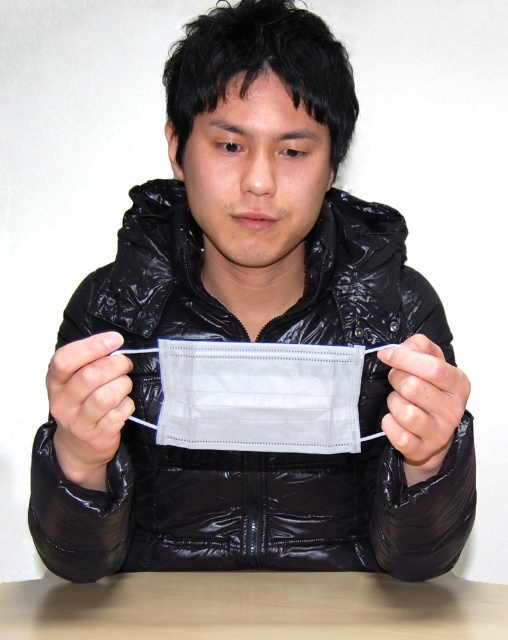
Question: Can you confirm if black shiny jacket at center is positioned to the right of white matte fabric mask at center?

Choices:
 (A) no
 (B) yes

Answer: (B)

Question: Is light brown wooden table at lower center to the right of white matte fabric mask at center from the viewer's perspective?

Choices:
 (A) no
 (B) yes

Answer: (B)

Question: Does light brown wooden table at lower center have a larger size compared to white matte mask at center?

Choices:
 (A) no
 (B) yes

Answer: (B)

Question: Based on their relative distances, which object is nearer to the white matte mask at center?

Choices:
 (A) white matte fabric mask at center
 (B) light brown wooden table at lower center

Answer: (A)

Question: Which of these objects is positioned closest to the white matte mask at center?

Choices:
 (A) light brown wooden table at lower center
 (B) white matte fabric mask at center
 (C) black shiny jacket at center

Answer: (B)

Question: Among these points, which one is farthest from the camera?

Choices:
 (A) [304, 332]
 (B) [120, 396]
 (C) [414, 413]

Answer: (A)